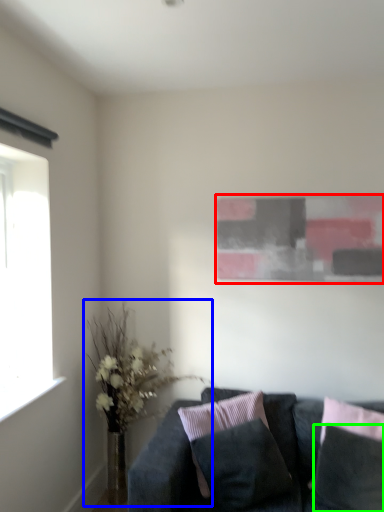
Question: Estimate the real-world distances between objects in this image. Which object is farther from picture frame (highlighted by a red box), houseplant (highlighted by a blue box) or pillow (highlighted by a green box)?

Choices:
 (A) houseplant
 (B) pillow

Answer: (B)